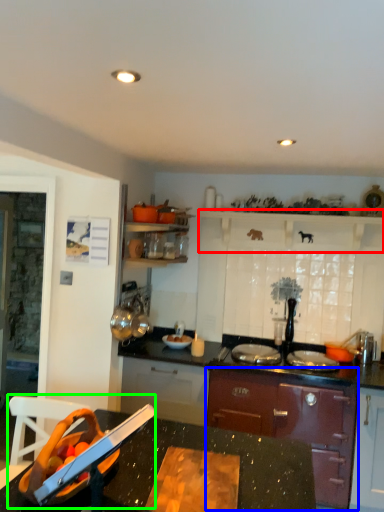
Question: Considering the real-world distances, which object is farthest from shelf (highlighted by a red box)? cabinetry (highlighted by a blue box) or sink (highlighted by a green box)?

Choices:
 (A) cabinetry
 (B) sink

Answer: (B)